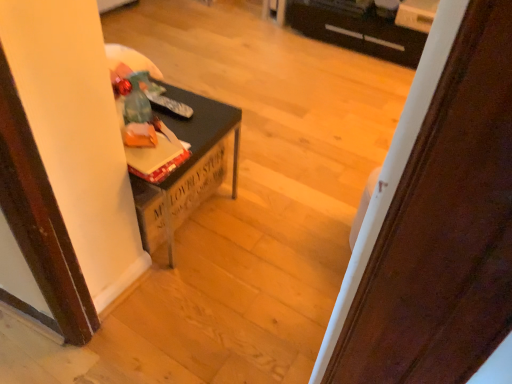
At what (x,y) coordinates should I click in order to perform the action: click on blank space to the left of black plastic drawer at upper center. Please return your answer as a coordinate pair (x, y). Looking at the image, I should click on (292, 51).